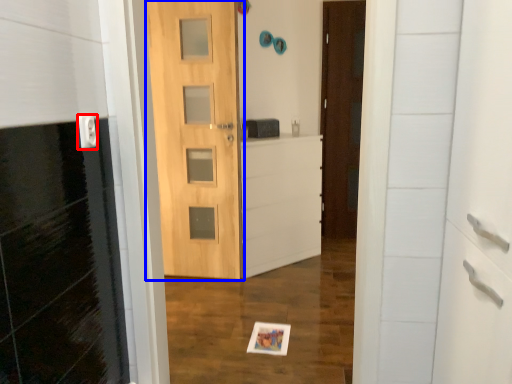
Question: Which object is closer to the camera taking this photo, electric outlet (highlighted by a red box) or door (highlighted by a blue box)?

Choices:
 (A) electric outlet
 (B) door

Answer: (A)